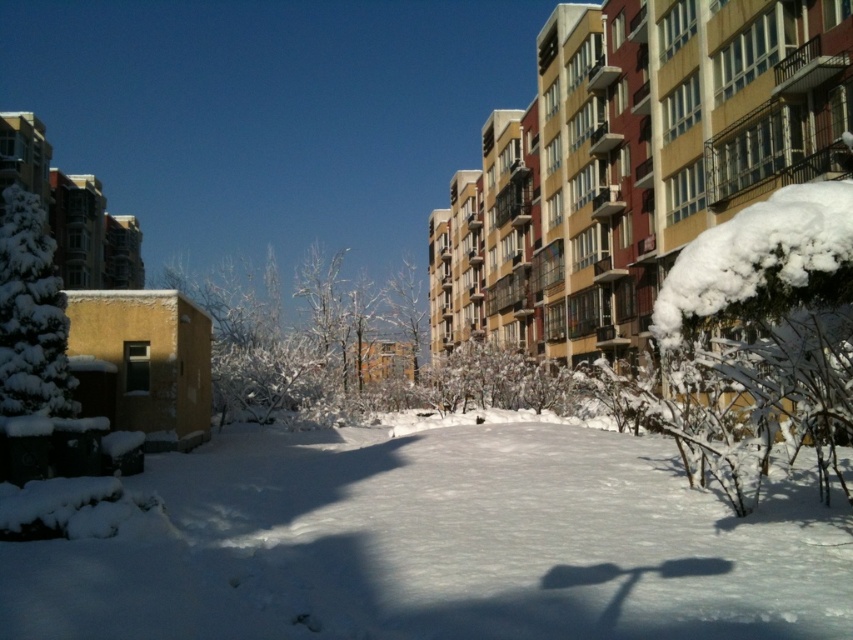
You are standing at the point with coordinates point (21, 349) and want to walk towards the point with coordinates point (173, 620). Which direction should you move relative to the point you are currently at?

You should move forward because point (173, 620) is in front of point (21, 349).

Looking at this image, you are standing in the winter scene and want to take a photo of the white frosty tree at center and the white fluffy snow at lower right. Where should you position yourself to ensure both are visible in the frame?

Position yourself below the white frosty tree at center so that it appears above the white fluffy snow at lower right in the frame.

Please look at the image and locate the point specified by the coordinates. What object is located at point (x=440, y=547)?

The point (x=440, y=547) corresponds to the white fluffy snow at center.